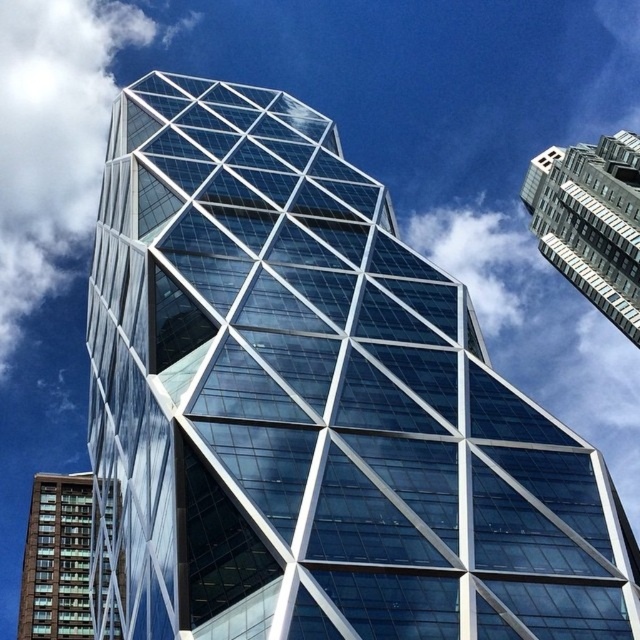
You are an architect analyzing the city skyline. You observe the glassy steel skyscraper at upper right and the green glass building at lower left. Which of these two buildings is situated higher in the image?

The glassy steel skyscraper at upper right is positioned over the green glass building at lower left, meaning it is higher in the image.

You are an architect analyzing the image of the skyscraper. You notice the white fluffy cloud at upper left and the glassy steel skyscraper at upper right. Which of these two objects has a greater width in the image?

The white fluffy cloud at upper left has a greater width than the glassy steel skyscraper at upper right according to the description.

Looking at this image, you are an architect analyzing the layout of the city skyline. You notice the white fluffy cloud at upper left and the green glass building at lower left. Based on their positions, which one is located to the east if the sun is setting in the west?

The white fluffy cloud at upper left is to the left of the green glass building at lower left. Since the sun is setting in the west, the east would be to the left. Therefore, the white fluffy cloud at upper left is located to the east.